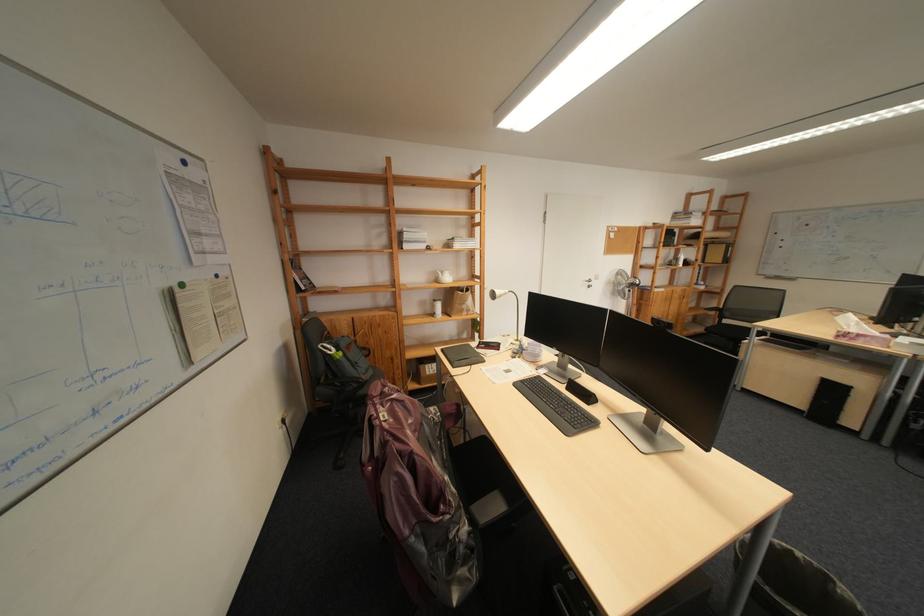
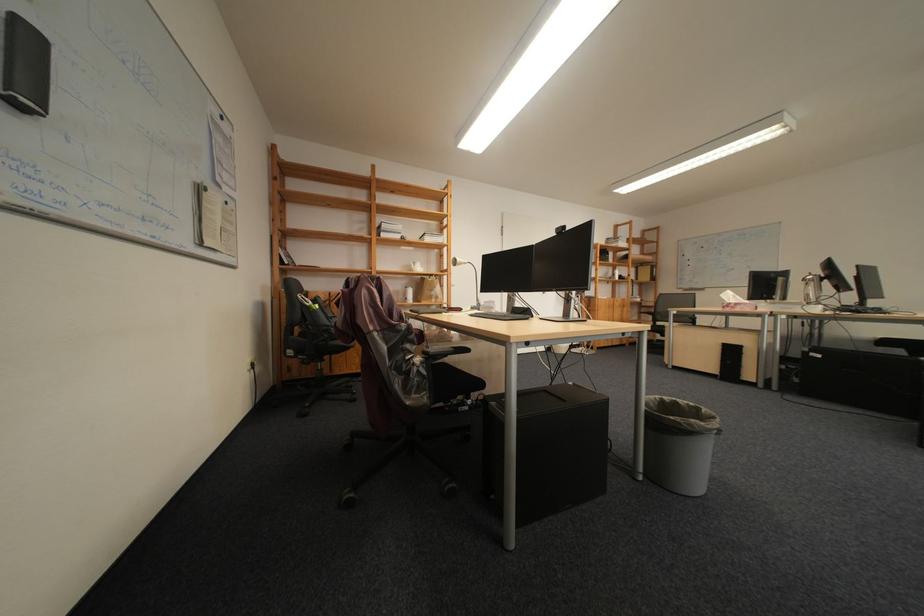
In a continuous first-person perspective shot, in which direction is the camera moving?

The movement direction of the cameraman is right, backward.